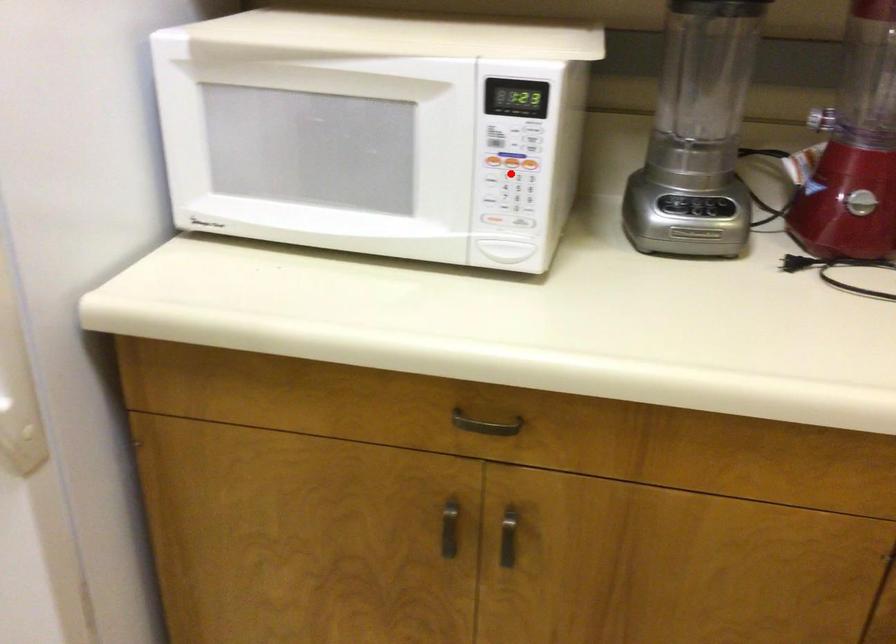
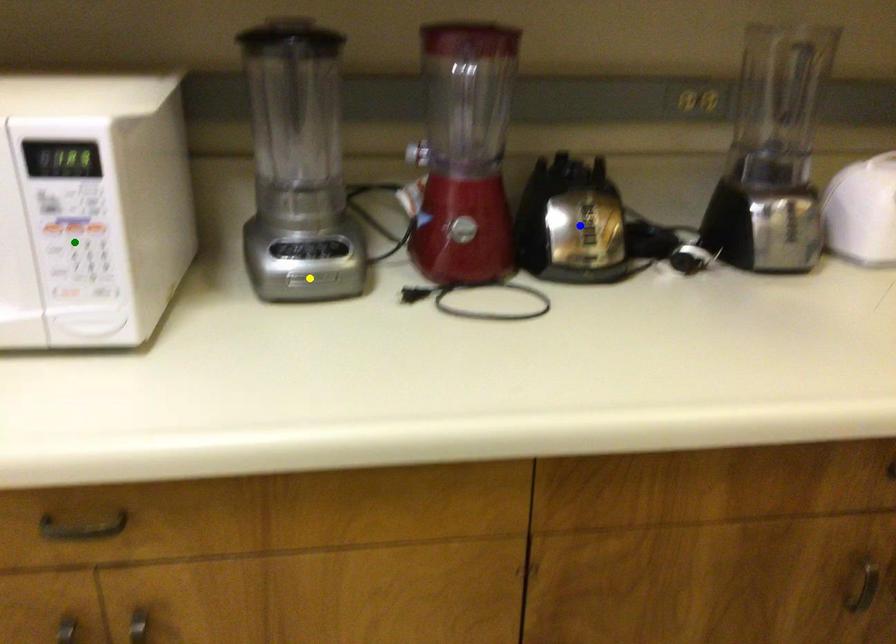
Question: I am providing you with two images of the same scene from different viewpoints. A red point is marked on the first image. You are given multiple points on the second image. Can you choose the point in image 2 that corresponds to the point in image 1?

Choices:
 (A) blue point
 (B) green point
 (C) yellow point

Answer: (B)